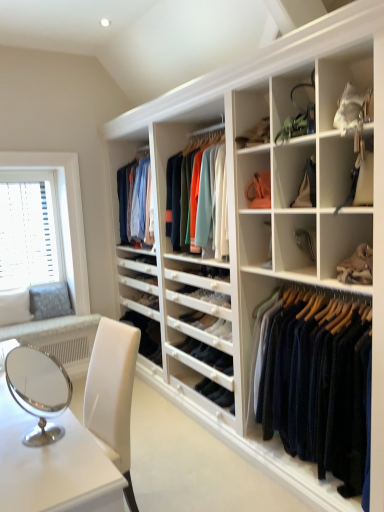
Question: Would you say white plastic blinds at left is outside leather handbag at center right, the first shelf positioned from the bottom?

Choices:
 (A) yes
 (B) no

Answer: (A)

Question: Are white plastic blinds at left and leather handbag at center right, the first shelf positioned from the bottom, far apart?

Choices:
 (A) no
 (B) yes

Answer: (B)

Question: From the image's perspective, is white plastic blinds at left above leather handbag at center right, which ranks as the fourth shelf in top-to-bottom order?

Choices:
 (A) no
 (B) yes

Answer: (B)

Question: Is white plastic blinds at left bigger than leather handbag at center right, which ranks as the fourth shelf in top-to-bottom order?

Choices:
 (A) no
 (B) yes

Answer: (B)

Question: Does white plastic blinds at left come in front of leather handbag at center right, which ranks as the fourth shelf in top-to-bottom order?

Choices:
 (A) yes
 (B) no

Answer: (B)

Question: Would you say white matte shelf at center, marked as the second shelf in a bottom-to-top arrangement, is inside or outside matte green handbag at upper right, which appears as the 4th shelf when ordered from the bottom?

Choices:
 (A) inside
 (B) outside

Answer: (B)

Question: Relative to matte green handbag at upper right, which appears as the 4th shelf when ordered from the bottom, is white matte shelf at center, marked as the second shelf in a bottom-to-top arrangement, in front or behind?

Choices:
 (A) front
 (B) behind

Answer: (B)

Question: From the image's perspective, is white matte shelf at center, marked as the second shelf in a bottom-to-top arrangement, positioned above or below matte green handbag at upper right, the 1th shelf from the top?

Choices:
 (A) above
 (B) below

Answer: (B)

Question: In terms of size, does white matte shelf at center, marked as the second shelf in a bottom-to-top arrangement, appear bigger or smaller than matte green handbag at upper right, the 1th shelf from the top?

Choices:
 (A) big
 (B) small

Answer: (A)

Question: From the image's perspective, relative to white plastic blinds at left, is navy wool sweater at center above or below?

Choices:
 (A) below
 (B) above

Answer: (A)

Question: In terms of size, does navy wool sweater at center appear bigger or smaller than white plastic blinds at left?

Choices:
 (A) small
 (B) big

Answer: (B)

Question: Considering the positions of point (317, 313) and point (39, 254), is point (317, 313) closer or farther from the camera than point (39, 254)?

Choices:
 (A) closer
 (B) farther

Answer: (A)

Question: Considering their positions, is navy wool sweater at center located in front of or behind white plastic blinds at left?

Choices:
 (A) behind
 (B) front

Answer: (B)

Question: From the image's perspective, is matte black purse at upper right, the 2th shelf when ordered from top to bottom, positioned above or below matte green handbag at upper right, the 1th shelf from the top?

Choices:
 (A) above
 (B) below

Answer: (B)

Question: Is matte black purse at upper right, the 2th shelf when ordered from top to bottom, taller or shorter than matte green handbag at upper right, which appears as the 4th shelf when ordered from the bottom?

Choices:
 (A) tall
 (B) short

Answer: (A)